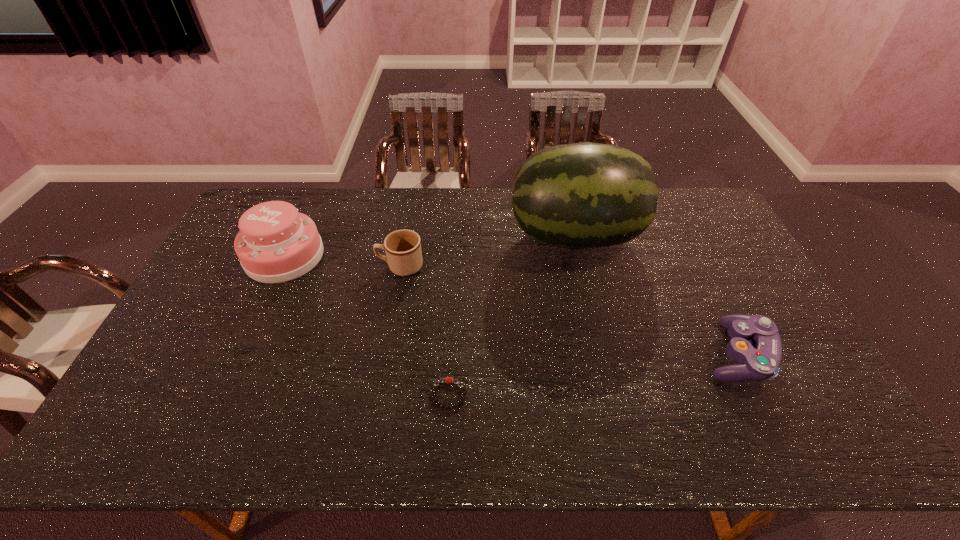
The image size is (960, 540). I want to click on blank region between the shortest object and the control, so click(592, 374).

Locate an element on the screen. unoccupied area between the bracelet and the mug is located at coordinates (424, 330).

This screenshot has height=540, width=960. In order to click on vacant point located between the control and the mug in this screenshot , I will do `click(568, 310)`.

Image resolution: width=960 pixels, height=540 pixels. Find the location of `empty location between the second tallest object and the second object from right to left`. empty location between the second tallest object and the second object from right to left is located at coordinates (429, 246).

Point out which object is positioned as the third nearest to the second tallest object. Please provide its 2D coordinates. Your answer should be formatted as a tuple, i.e. [(x, y)], where the tuple contains the x and y coordinates of a point satisfying the conditions above.

[(582, 195)]

Identify the location of object that stands as the closest to the fourth shortest object. This screenshot has width=960, height=540. (403, 251).

At what (x,y) coordinates should I click in order to perform the action: click on vacant area that satisfies the following two spatial constraints: 1. on the front side of the birthday cake; 2. on the left side of the control. Please return your answer as a coordinate pair (x, y). The height and width of the screenshot is (540, 960). Looking at the image, I should click on (240, 354).

Image resolution: width=960 pixels, height=540 pixels. Find the location of `vacant area that satisfies the following two spatial constraints: 1. on the side of the second object from left to right with the handle; 2. on the back side of the tallest object`. vacant area that satisfies the following two spatial constraints: 1. on the side of the second object from left to right with the handle; 2. on the back side of the tallest object is located at coordinates (406, 237).

You are a GUI agent. You are given a task and a screenshot of the screen. Output one action in this format:
    pyautogui.click(x=<x>, y=<y>)
    Task: Click on the free space that satisfies the following two spatial constraints: 1. on the back side of the leftmost object; 2. on the left side of the second object from right to left
    The height and width of the screenshot is (540, 960).
    Given the screenshot: What is the action you would take?
    pyautogui.click(x=293, y=237)

Identify the location of vacant space that satisfies the following two spatial constraints: 1. on the side of the mug with the handle; 2. on the front side of the second tallest object. This screenshot has width=960, height=540. (402, 256).